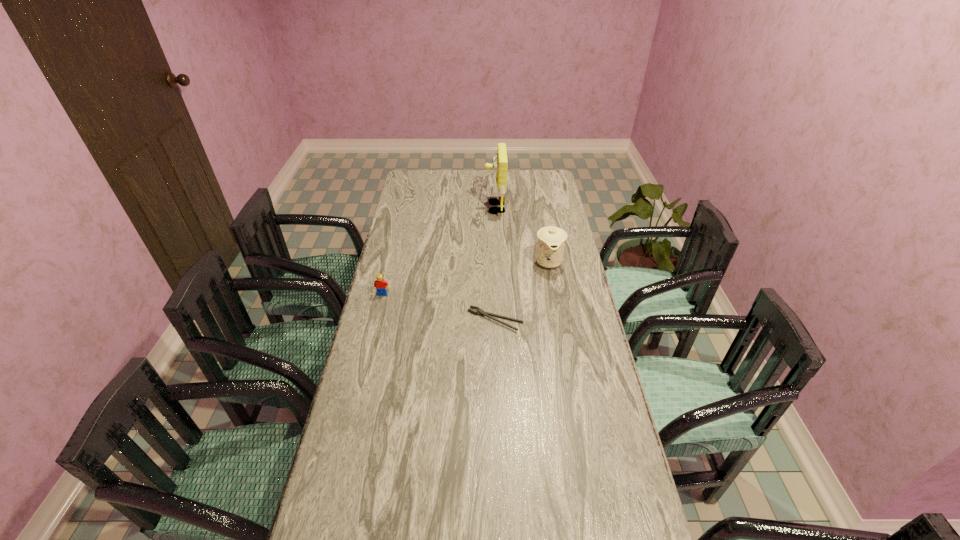
This screenshot has height=540, width=960. Identify the location of object that stands as the second closest to the farthest object. (481, 312).

Locate an element on the screen. object that can be found as the second closest to the tongs is located at coordinates (380, 284).

The image size is (960, 540). Find the location of `free location that satisfies the following two spatial constraints: 1. on the face of the farthest object; 2. on the face of the leftmost object`. free location that satisfies the following two spatial constraints: 1. on the face of the farthest object; 2. on the face of the leftmost object is located at coordinates (498, 294).

Find the location of `free spot that satisfies the following two spatial constraints: 1. on the face of the nearest object; 2. on the right side of the leftmost object`. free spot that satisfies the following two spatial constraints: 1. on the face of the nearest object; 2. on the right side of the leftmost object is located at coordinates (376, 320).

I want to click on vacant space that satisfies the following two spatial constraints: 1. on the face of the nearest object; 2. on the left side of the third tallest object, so click(x=376, y=320).

I want to click on vacant space that satisfies the following two spatial constraints: 1. on the face of the tallest object; 2. on the front side of the tongs, so click(x=499, y=320).